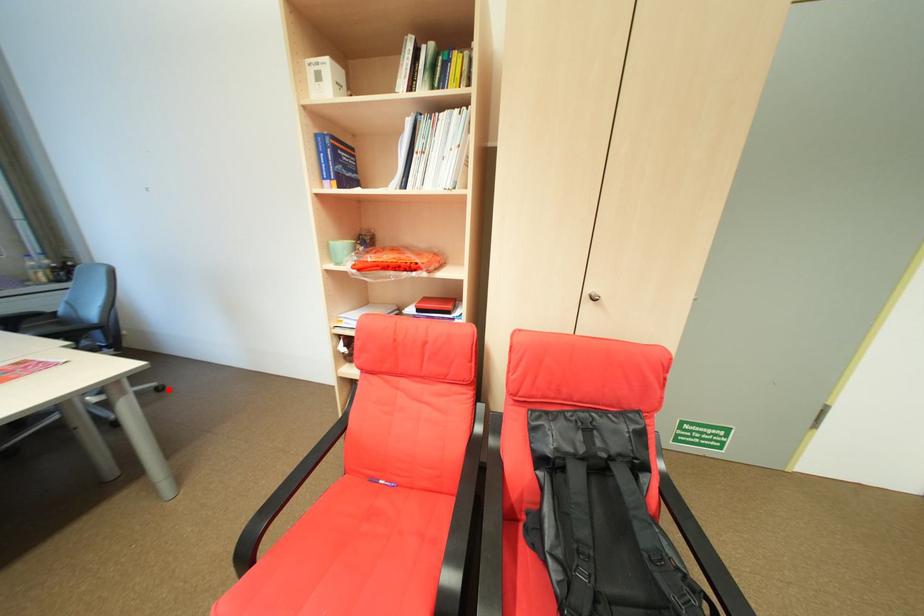
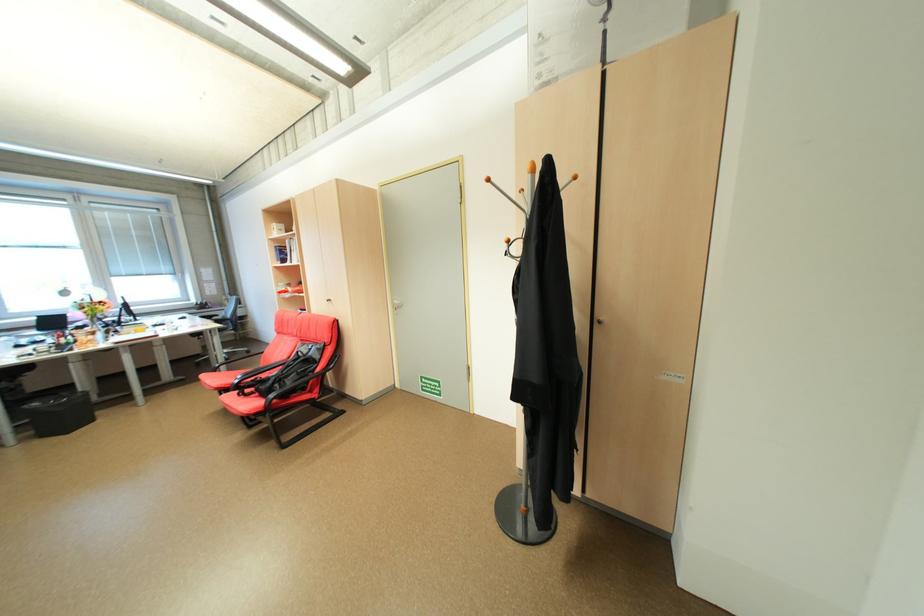
The point at the highlighted location is marked in the first image. Where is the corresponding point in the second image?

(257, 353)